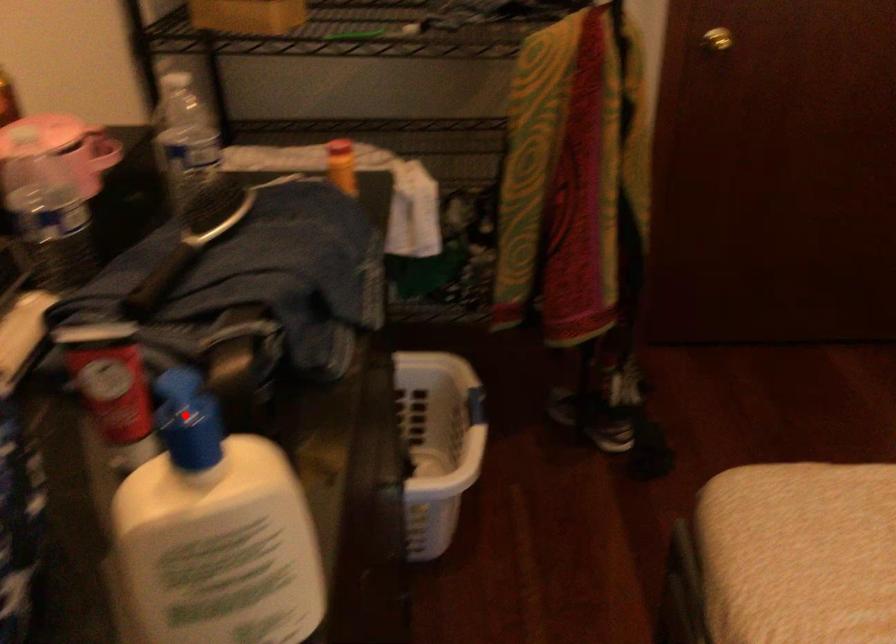
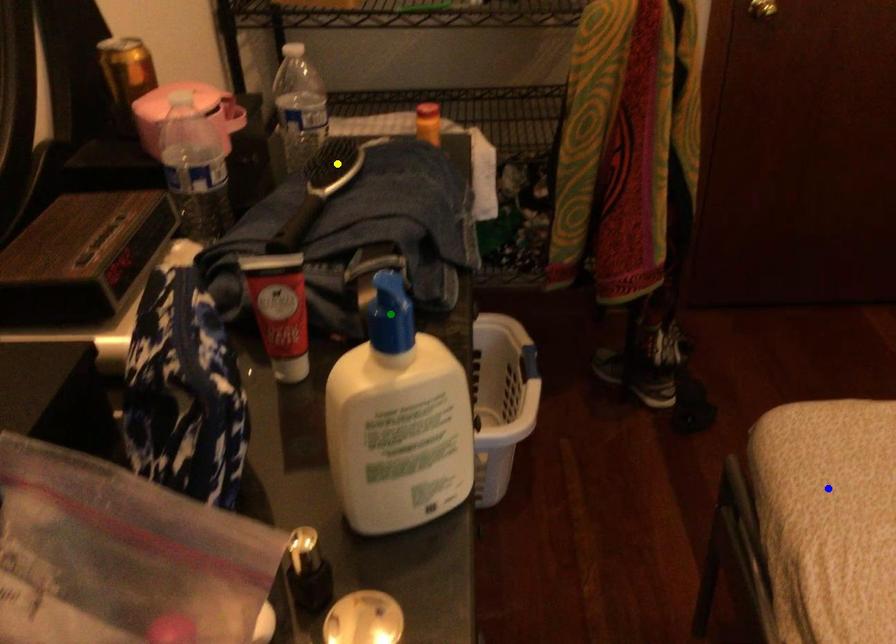
Question: I am providing you with two images of the same scene from different viewpoints. A red point is marked on the first image. You are given multiple points on the second image. Which mark in image 2 goes with the point in image 1?

Choices:
 (A) yellow point
 (B) green point
 (C) blue point

Answer: (B)